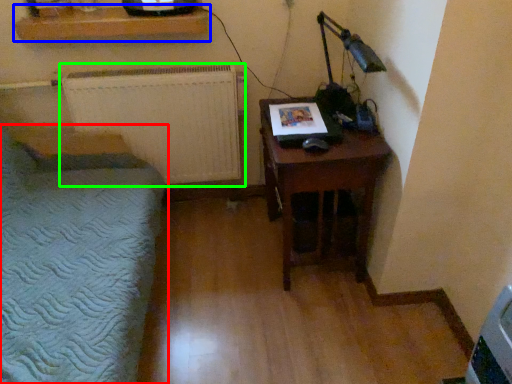
Question: Which is nearer to the furniture (highlighted by a red box)? shelf (highlighted by a blue box) or radiator (highlighted by a green box).

Choices:
 (A) shelf
 (B) radiator

Answer: (B)